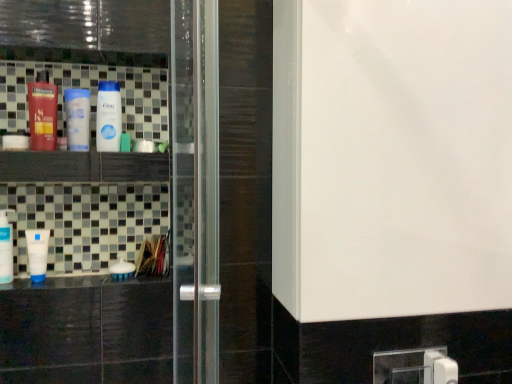
What are the coordinates of `free point above white glossy counter top at lower left (from a real-world perspective)` in the screenshot? It's located at (92, 275).